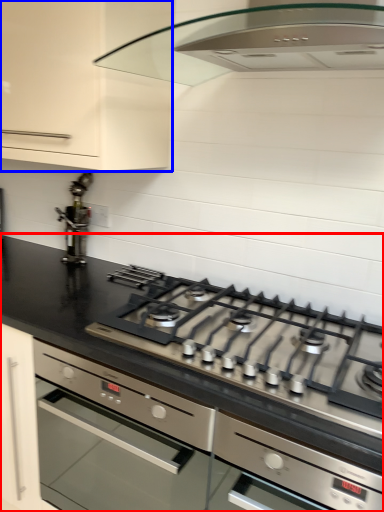
Question: Which point is further to the camera, countertop (highlighted by a red box) or cabinetry (highlighted by a blue box)?

Choices:
 (A) countertop
 (B) cabinetry

Answer: (B)